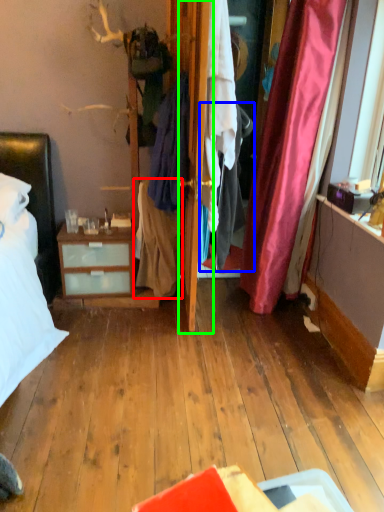
Question: Which object is the closest to the clothing (highlighted by a red box)? Choose among these: clothing (highlighted by a blue box) or door (highlighted by a green box).

Choices:
 (A) clothing
 (B) door

Answer: (A)